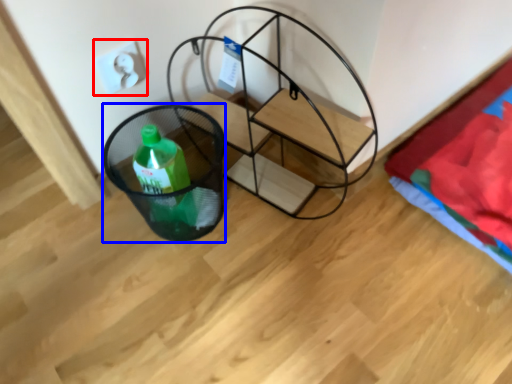
Question: Which point is further to the camera, electric outlet (highlighted by a red box) or basket (highlighted by a blue box)?

Choices:
 (A) electric outlet
 (B) basket

Answer: (A)